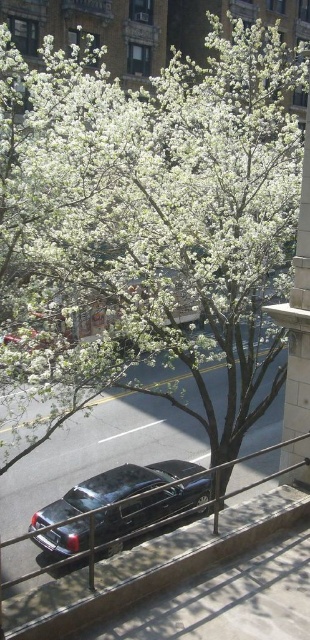
You are standing at the center of the image and want to walk towards the metallic gray rail at lower center. Which direction should you move in to reach it?

Since the metallic gray rail at lower center is located at point 0.887 on the x axis and 0.487 on the y axis, you should move towards the lower center direction to reach it.

You are a pedestrian standing on the sidewalk and want to cross the street. There is a metallic gray rail at lower center and a shiny black car at center. Which object is closer to you?

The metallic gray rail at lower center is positioned over the shiny black car at center, meaning the metallic gray rail at lower center is closer to you.